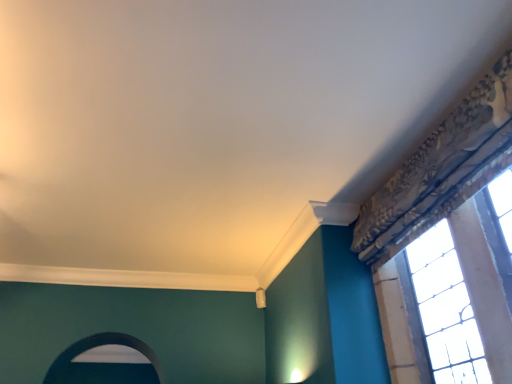
Question: Is stained glass window at upper right inside or outside of smooth white archway at lower left?

Choices:
 (A) outside
 (B) inside

Answer: (A)

Question: In terms of size, does stained glass window at upper right appear bigger or smaller than smooth white archway at lower left?

Choices:
 (A) big
 (B) small

Answer: (A)

Question: From a real-world perspective, is stained glass window at upper right physically located above or below smooth white archway at lower left?

Choices:
 (A) above
 (B) below

Answer: (B)

Question: Relative to stained glass window at upper right, is smooth white archway at lower left in front or behind?

Choices:
 (A) front
 (B) behind

Answer: (B)

Question: Looking at their shapes, would you say smooth white archway at lower left is wider or thinner than stained glass window at upper right?

Choices:
 (A) wide
 (B) thin

Answer: (A)

Question: Is point (151, 365) positioned closer to the camera than point (432, 233)?

Choices:
 (A) farther
 (B) closer

Answer: (A)

Question: Visually, is smooth white archway at lower left positioned to the left or to the right of stained glass window at upper right?

Choices:
 (A) right
 (B) left

Answer: (B)